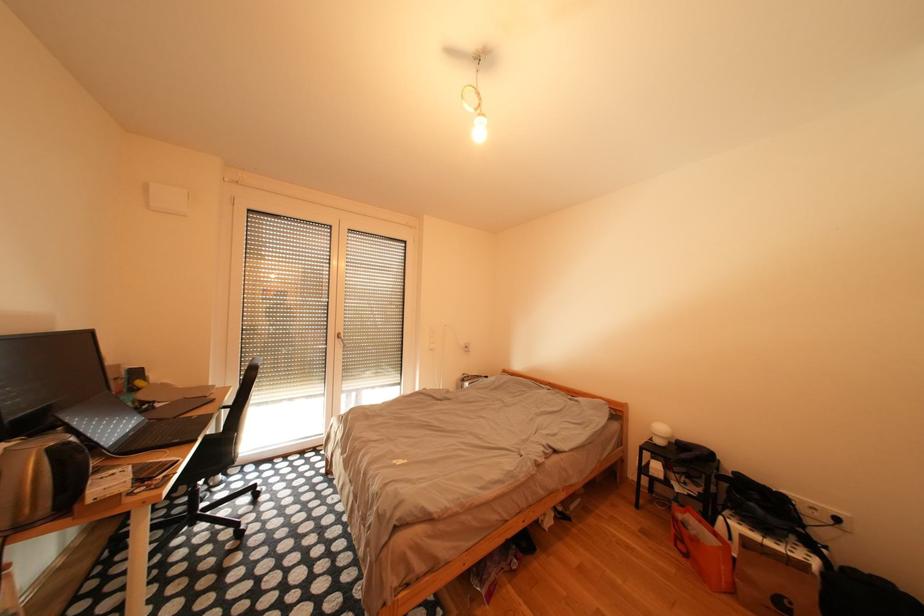
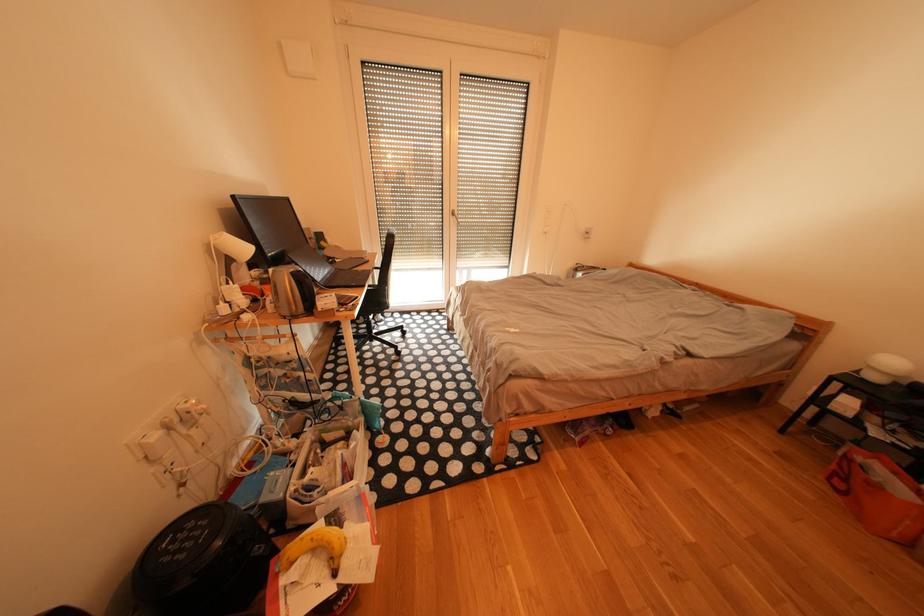
The first image is from the beginning of the video and the second image is from the end. How did the camera likely rotate when shooting the video?

The camera rotated toward left-down.